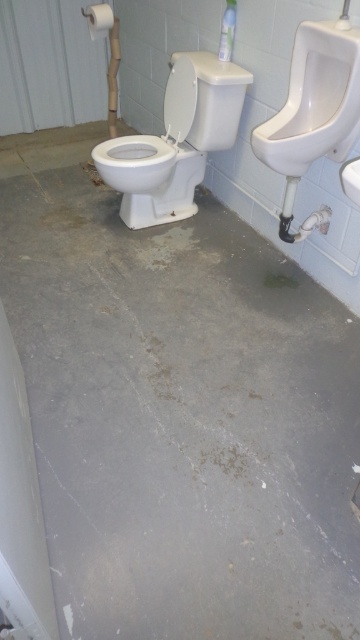
Is point (163, 211) behind point (352, 170)?

Yes, it is behind point (352, 170).

Image resolution: width=360 pixels, height=640 pixels. What do you see at coordinates (176, 140) in the screenshot? I see `white glossy toilet bowl at center` at bounding box center [176, 140].

What do you see at coordinates (176, 140) in the screenshot?
I see `white glossy toilet bowl at center` at bounding box center [176, 140].

This screenshot has width=360, height=640. I want to click on white glossy toilet bowl at center, so 176,140.

Does white glossy toilet bowl at center have a lesser height compared to white glossy urinal at upper right?

No.

Is white glossy toilet bowl at center closer to the viewer compared to white glossy urinal at upper right?

No, white glossy toilet bowl at center is further to the viewer.

Identify the location of white glossy toilet bowl at center. (176, 140).

From the picture: Can you confirm if white glossy urinal at upper right is smaller than white glossy sink at upper right?

Actually, white glossy urinal at upper right might be larger than white glossy sink at upper right.

Is white glossy urinal at upper right positioned before white glossy sink at upper right?

No, it is behind white glossy sink at upper right.

Who is more distant from viewer, (281, 141) or (356, 161)?

Positioned behind is point (281, 141).

This screenshot has width=360, height=640. In order to click on white glossy urinal at upper right in this screenshot , I will do `click(315, 100)`.